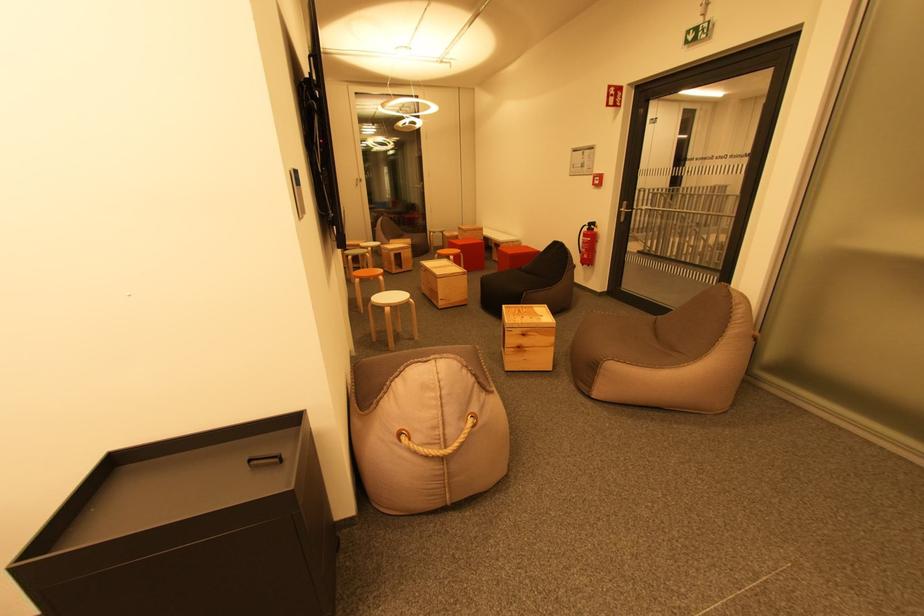
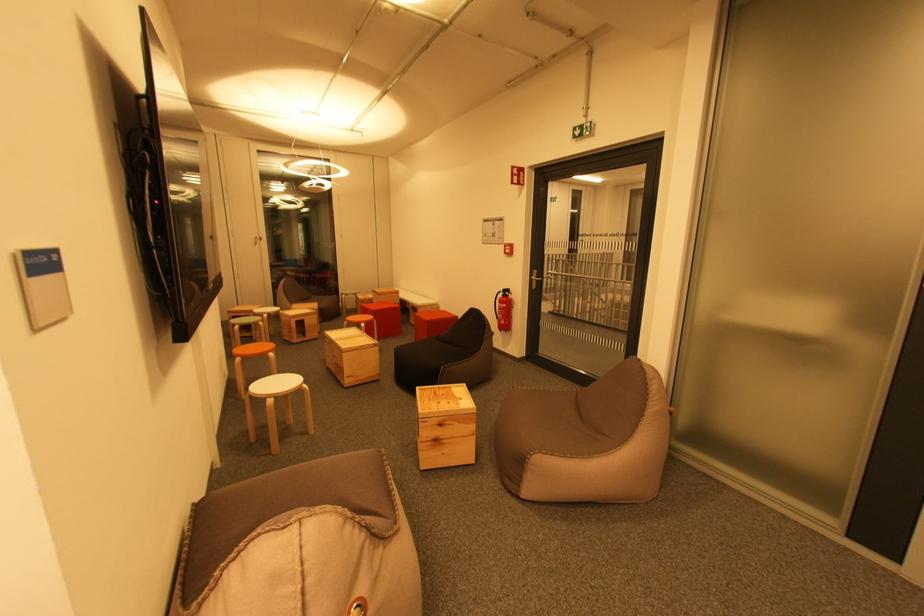
Question: Based on the continuous images, in which direction is the camera rotating? Reply with the corresponding letter.

Choices:
 (A) Left
 (B) Right
 (C) Up
 (D) Down

Answer: (B)